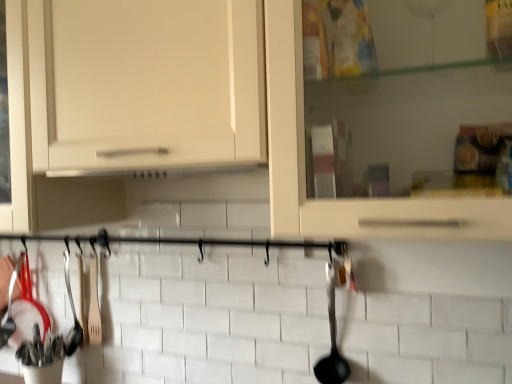
Question: Would you say white matte cabinet at center is to the left or to the right of black plastic ladle at right, which is the second silverware from back to front, in the picture?

Choices:
 (A) right
 (B) left

Answer: (B)

Question: Is white matte cabinet at center taller or shorter than black plastic ladle at right, placed as the first silverware when sorted from front to back?

Choices:
 (A) short
 (B) tall

Answer: (B)

Question: Which object is positioned closest to the wooden spatula at left, positioned as the 2th silverware in front-to-back order?

Choices:
 (A) black plastic ladle at right, acting as the 2th silverware starting from the left
 (B) white matte cabinet at center

Answer: (A)

Question: Which object is positioned closest to the wooden spatula at left, the 1th silverware viewed from the back?

Choices:
 (A) black plastic ladle at right, the 1th silverware when ordered from right to left
 (B) white matte cabinet at center

Answer: (A)